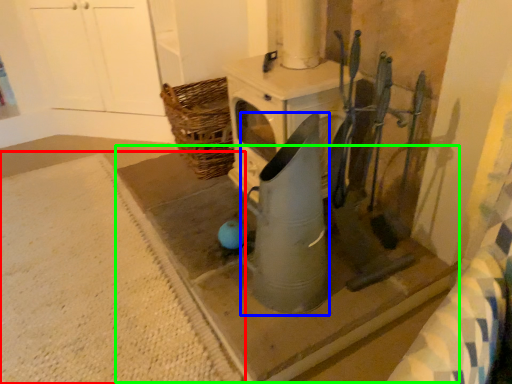
Question: Estimate the real-world distances between objects in this image. Which object is farther from concrete (highlighted by a red box), appliance (highlighted by a blue box) or concrete (highlighted by a green box)?

Choices:
 (A) appliance
 (B) concrete

Answer: (A)